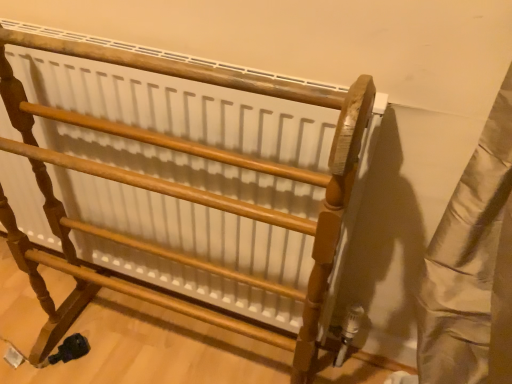
Describe the element at coordinates (188, 191) in the screenshot. This screenshot has width=512, height=384. I see `wooden rack at center` at that location.

You are a GUI agent. You are given a task and a screenshot of the screen. Output one action in this format:
    pyautogui.click(x=<x>, y=<y>)
    Task: Click on the wooden rack at center
    
    Given the screenshot: What is the action you would take?
    pyautogui.click(x=188, y=191)

This screenshot has height=384, width=512. In order to click on wooden rack at center in this screenshot , I will do pos(188,191).